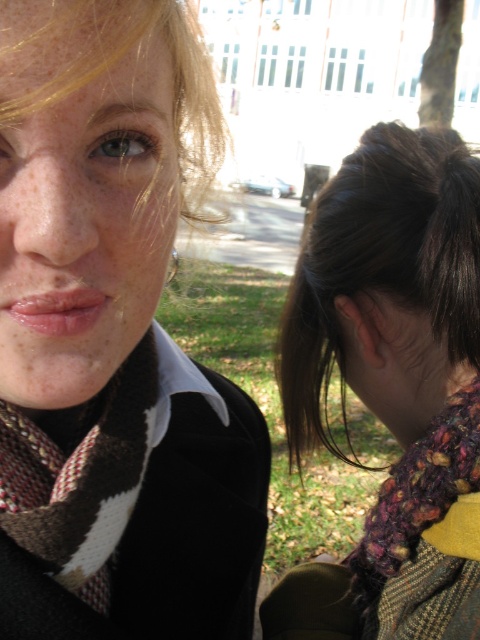
You are organizing a fashion show and need to decide which scarf to feature based on size. Which of the two scarves, the matte brown scarf at upper left or the brown and white knitted scarf at left, is bigger?

The matte brown scarf at upper left has a larger size compared to the brown and white knitted scarf at left, so the matte brown scarf at upper left is bigger.

You are holding a camera and want to take a photo of the person on the right. The camera has a focus range that can only focus on objects within 15 inches. Is the point at coordinates point [44,564] close enough for the camera to focus on the person on the right?

The point at coordinates point [44,564] is 17.20 inches from the camera, which is beyond the focus range of 15 inches. Therefore, the camera cannot focus on the person on the right at this distance.

You are a fashion designer observing two scarves in an image. The first is a matte brown scarf at upper left and the second is a knitted multicolor scarf at lower right. Which scarf takes up more space in the image?

The knitted multicolor scarf at lower right takes up more space in the image than the matte brown scarf at upper left because the matte brown scarf at upper left occupies less space than knitted multicolor scarf at lower right.